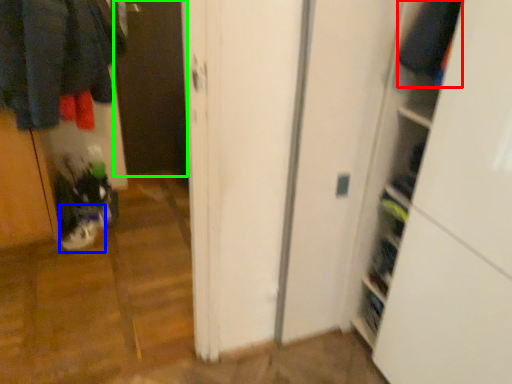
Question: Based on their relative distances, which object is farther from clothing (highlighted by a red box)? Choose from footwear (highlighted by a blue box) and screen door (highlighted by a green box).

Choices:
 (A) footwear
 (B) screen door

Answer: (B)